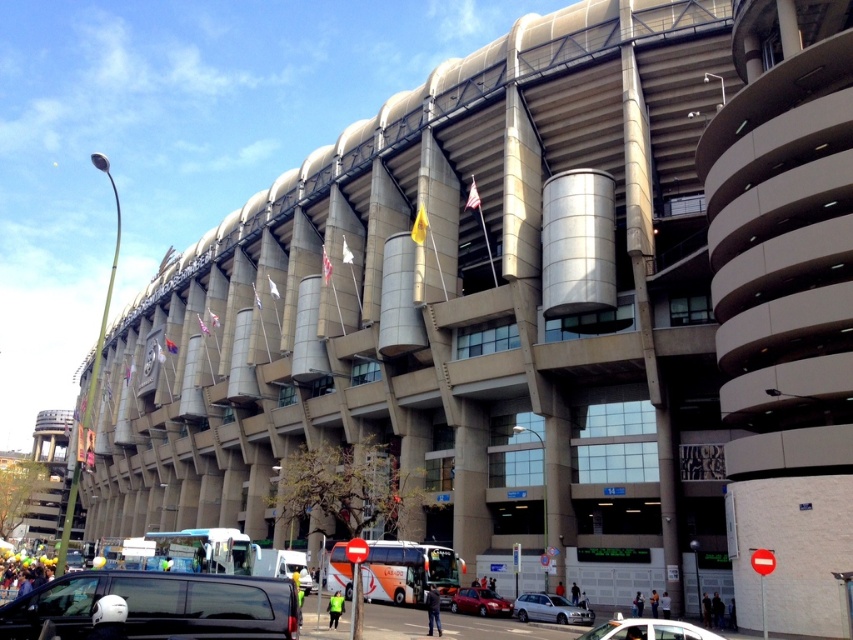
You are standing at the entrance of the stadium and see the white glossy car at lower center. If you want to locate it precisely on a map with coordinates from 0 to 1 on both axes, what are its coordinates?

The white glossy car at lower center is located at coordinates approximately 0.986 on the x axis and 0.760 on the y axis.

You are a photographer positioned at the entrance of the stadium and want to capture both the white glossy car at lower center and the silver metallic sedan at center in your shot. Which car should you focus on first to ensure it appears larger in the photo?

The white glossy car at lower center is above the silver metallic sedan at center. Since it is closer to the photographer, focusing on it first will make it appear larger in the photo.